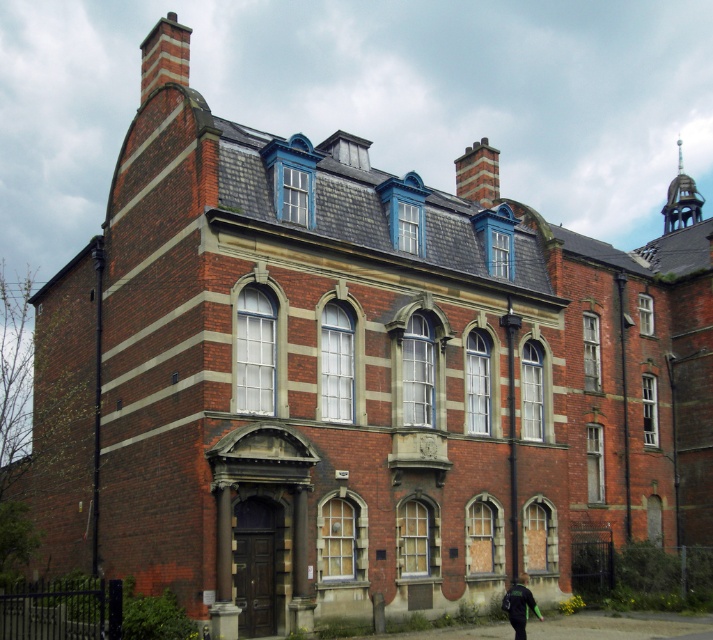
Image resolution: width=713 pixels, height=640 pixels. Identify the location of brick chimney at upper left. tap(164, 54).

Is point (174, 70) positioned in front of point (471, 157)?

Yes, point (174, 70) is in front of point (471, 157).

Who is more forward, (158, 36) or (476, 156)?

Point (158, 36)

At what (x,y) coordinates should I click in order to perform the action: click on brick chimney at upper left. Please return your answer as a coordinate pair (x, y). This screenshot has width=713, height=640. Looking at the image, I should click on (164, 54).

Who is positioned more to the left, brick chimney at upper center or green fabric jacket at lower center?

From the viewer's perspective, green fabric jacket at lower center appears more on the left side.

Measure the distance from brick chimney at upper center to green fabric jacket at lower center.

brick chimney at upper center and green fabric jacket at lower center are 161.76 feet apart from each other.

Is point (483, 164) behind point (513, 589)?

That is True.

Identify the location of brick chimney at upper center. This screenshot has width=713, height=640. (477, 173).

Is point (178, 65) farther from viewer compared to point (523, 592)?

That is True.

From the picture: Does brick chimney at upper left appear over green fabric jacket at lower center?

Yes, brick chimney at upper left is above green fabric jacket at lower center.

The width and height of the screenshot is (713, 640). I want to click on brick chimney at upper left, so click(164, 54).

I want to click on brick chimney at upper left, so click(164, 54).